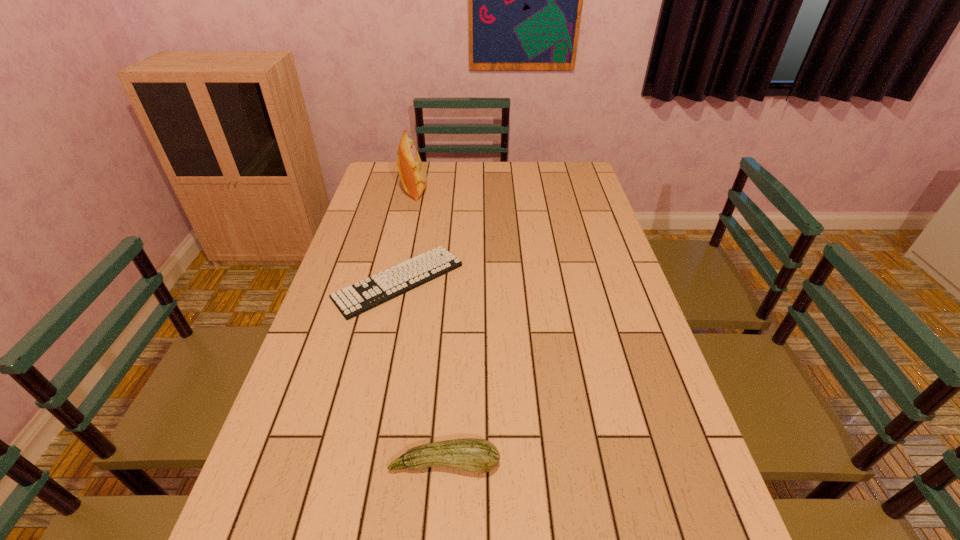
Locate an element on the screen. The image size is (960, 540). the tallest object is located at coordinates (413, 176).

The width and height of the screenshot is (960, 540). What are the coordinates of `crisp (potato chip)` in the screenshot? It's located at (413, 176).

Identify the location of the nearest object. (476, 455).

At what (x,y) coordinates should I click in order to perform the action: click on the second shortest object. Please return your answer as a coordinate pair (x, y). The height and width of the screenshot is (540, 960). Looking at the image, I should click on (476, 455).

Locate an element on the screen. Image resolution: width=960 pixels, height=540 pixels. the shortest object is located at coordinates (367, 294).

Where is `computer keyboard`? The image size is (960, 540). computer keyboard is located at coordinates (367, 294).

Find the location of a particular element. This screenshot has height=540, width=960. vacant space located 0.090m on the front-facing side of the farthest object is located at coordinates (450, 191).

Find the location of a particular element. vacant area situated 0.080m at the stem end of the nearest object is located at coordinates (442, 522).

I want to click on vacant space situated 0.050m on the front of the computer keyboard, so click(x=387, y=334).

Find the location of a particular element. The width and height of the screenshot is (960, 540). object that is at the far edge is located at coordinates (x=413, y=176).